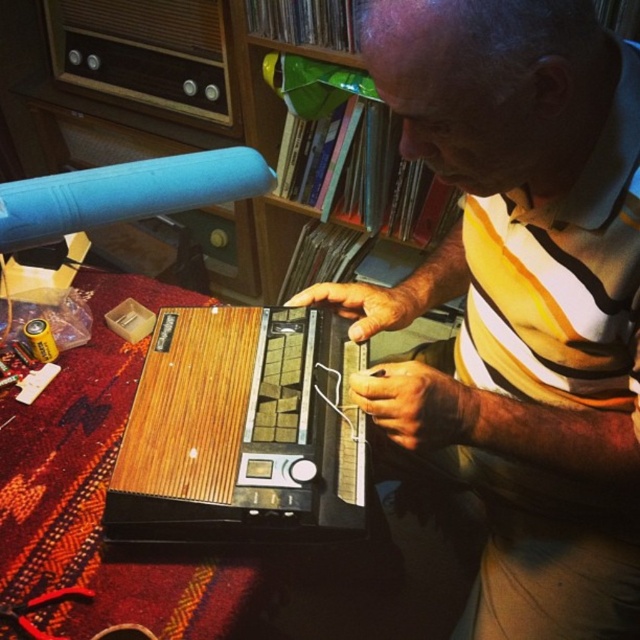
Question: Which object appears farthest from the camera in this image?

Choices:
 (A) wooden bookshelf at upper center
 (B) yellow striped shirt at center
 (C) wooden radio at center

Answer: (A)

Question: Where is yellow striped shirt at center located in relation to wooden radio at center in the image?

Choices:
 (A) below
 (B) above

Answer: (B)

Question: Which point appears closest to the camera in this image?

Choices:
 (A) (241, 72)
 (B) (147, 440)
 (C) (369, 29)

Answer: (C)

Question: Is wooden radio at center smaller than wooden bookshelf at upper center?

Choices:
 (A) no
 (B) yes

Answer: (B)

Question: Is wooden radio at center to the left of wooden bookshelf at upper center from the viewer's perspective?

Choices:
 (A) no
 (B) yes

Answer: (B)

Question: Which point appears closest to the camera in this image?

Choices:
 (A) (250, 36)
 (B) (150, 522)

Answer: (B)